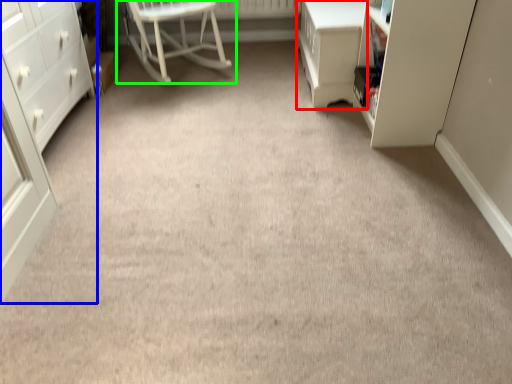
Question: Which object is positioned closest to vanity (highlighted by a red box)? Select from chest of drawers (highlighted by a blue box) and chair (highlighted by a green box).

Choices:
 (A) chest of drawers
 (B) chair

Answer: (B)